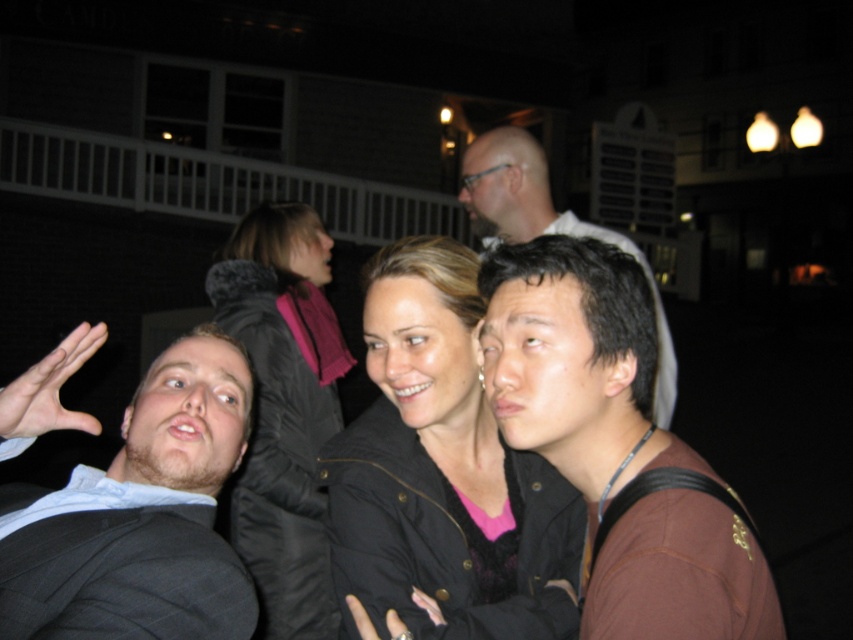
From the picture: You are standing in front of the group of four people in the image. There are two points marked in the scene. The first point is at coordinates point (631, 444) and the second is at point (256, 458). Which of these two points is closer to you?

Point (631, 444) is closer to the viewer than point (256, 458).

You are a photographer adjusting the camera settings for a group photo. The scene includes a gray suit at left and smooth brown hair at center. Which object should you focus on first if you want to ensure both are in focus, considering their sizes?

The gray suit at left is smaller in size compared to the smooth brown hair at center, so you should focus on the gray suit at left first to ensure both are in focus.

You are a photographer trying to capture a group shot of the people in the scene. You want to ensure that both the brown matte jacket at center and the black puffy jacket at upper center are clearly visible in the frame. Given their distance apart, do you think you can fit both into the camera frame without zooming in?

The brown matte jacket at center is 1.97 meters away from the black puffy jacket at upper center. Since the distance between them is relatively close, it should be possible to fit both into the camera frame without zooming in, provided the camera has a standard focal length lens.